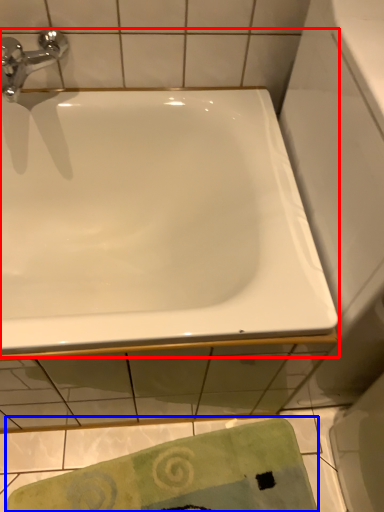
Question: Among these objects, which one is nearest to the camera, bathtub (highlighted by a red box) or beach towel (highlighted by a blue box)?

Choices:
 (A) bathtub
 (B) beach towel

Answer: (A)